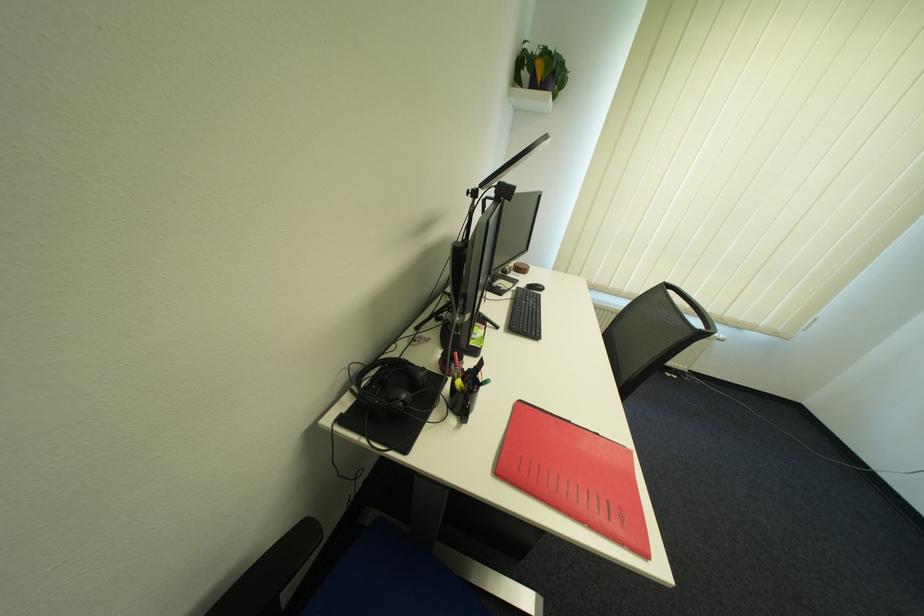
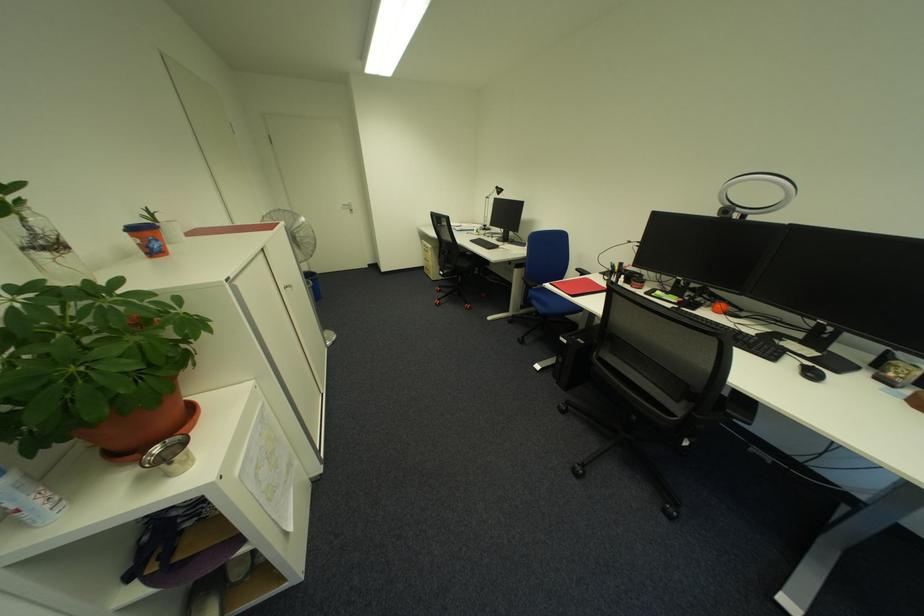
The point at (552,289) is marked in the first image. Where is the corresponding point in the second image?

(820, 376)